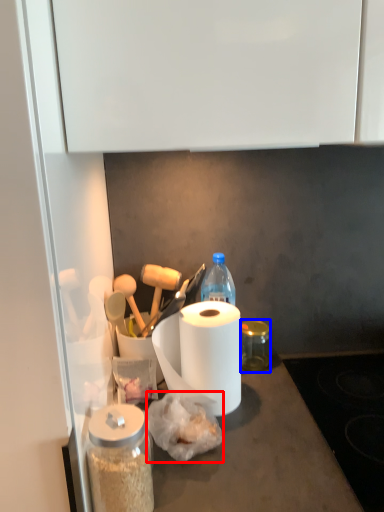
Question: Which object appears closest to the camera in this image, food (highlighted by a red box) or glass jar (highlighted by a blue box)?

Choices:
 (A) food
 (B) glass jar

Answer: (A)